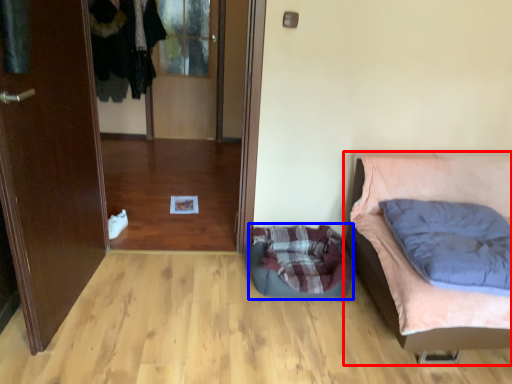
Question: Which object is closer to the camera taking this photo, furniture (highlighted by a red box) or dog bed (highlighted by a blue box)?

Choices:
 (A) furniture
 (B) dog bed

Answer: (A)